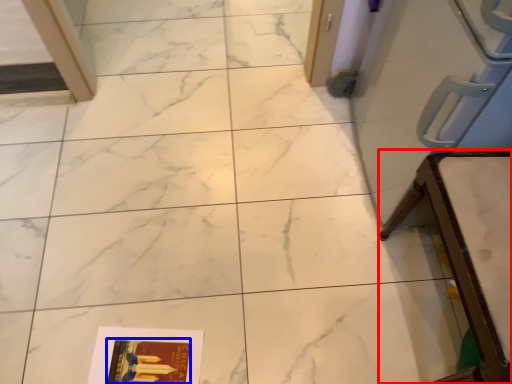
Question: Which object appears closest to the camera in this image, furniture (highlighted by a red box) or magazine (highlighted by a blue box)?

Choices:
 (A) furniture
 (B) magazine

Answer: (A)